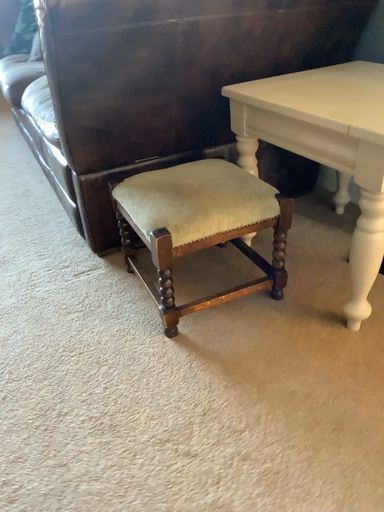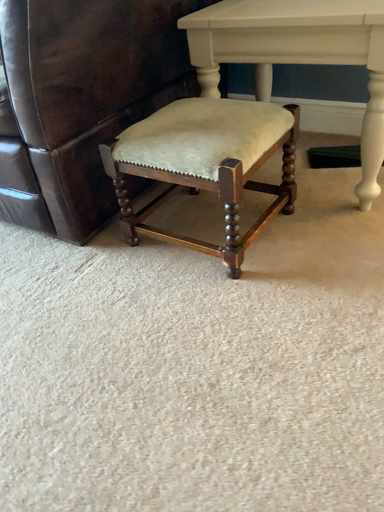
Question: How did the camera likely rotate when shooting the video?

Choices:
 (A) rotated right
 (B) rotated left

Answer: (A)